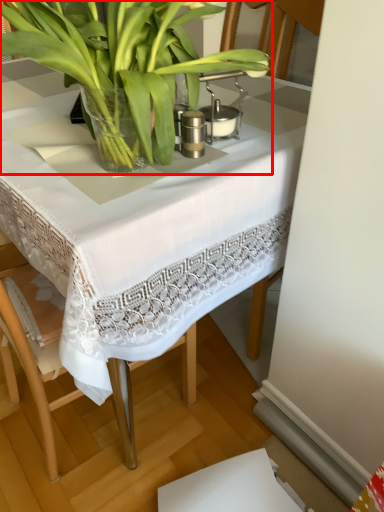
Question: Considering the relative positions of houseplant (annotated by the red box) and table in the image provided, where is houseplant (annotated by the red box) located with respect to the staircase?

Choices:
 (A) right
 (B) left

Answer: (A)